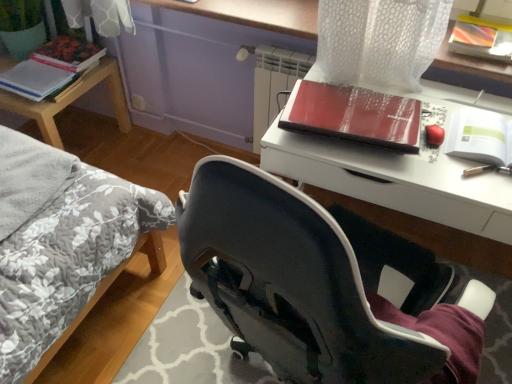
The image size is (512, 384). What are the coordinates of `free area behind green matte paperback book at upper right, acting as the first paperback book starting from the front` in the screenshot? It's located at (458, 107).